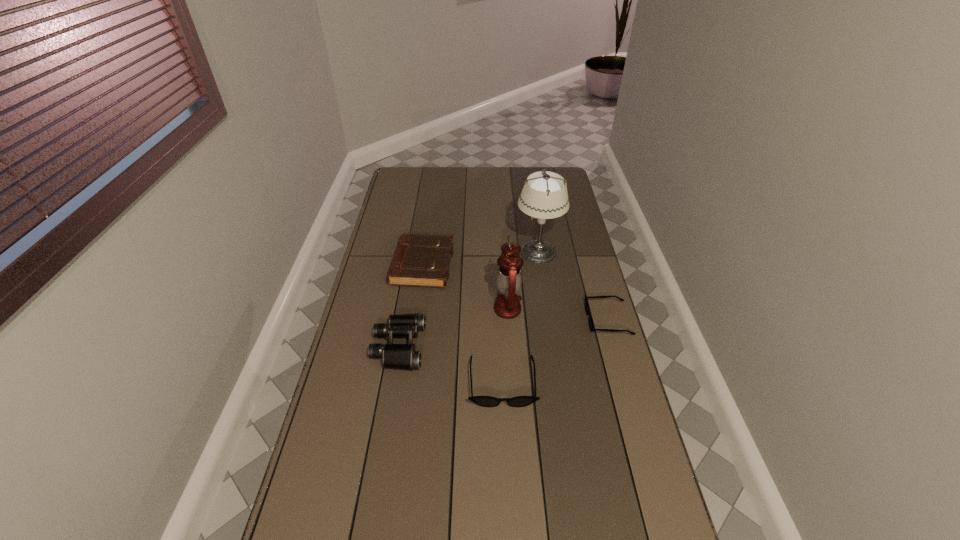
You are a GUI agent. You are given a task and a screenshot of the screen. Output one action in this format:
    pyautogui.click(x=<x>, y=<y>)
    Task: Click on the free space that satisfies the following two spatial constraints: 1. on the front side of the third shortest object; 2. on the front-facing side of the third tallest object
    The width and height of the screenshot is (960, 540).
    Given the screenshot: What is the action you would take?
    pyautogui.click(x=411, y=346)